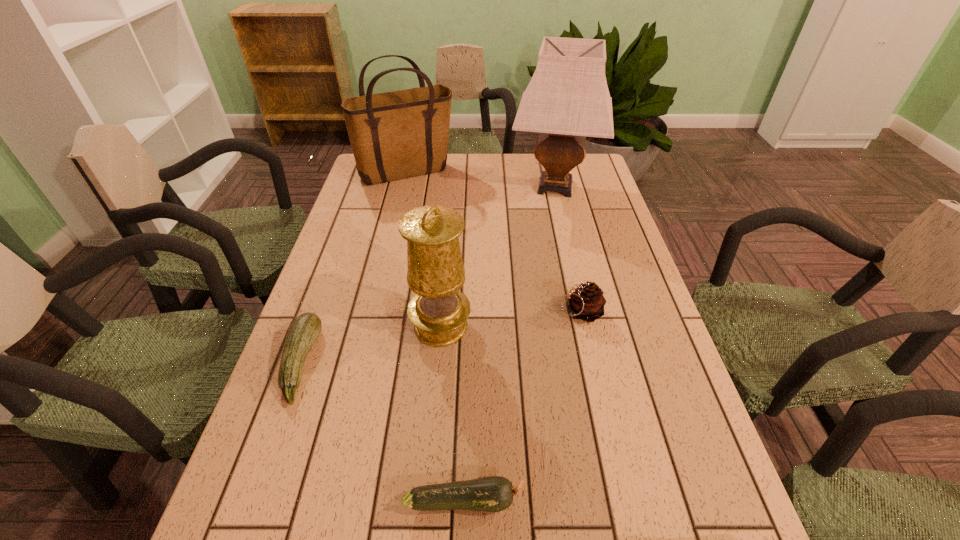
I want to click on lampshade at the right edge, so click(567, 99).

Locate an element on the screen. This screenshot has height=540, width=960. pinecone that is positioned at the right edge is located at coordinates (587, 303).

Identify the location of object that is at the far left corner. (400, 134).

You are a GUI agent. You are given a task and a screenshot of the screen. Output one action in this format:
    pyautogui.click(x=<x>, y=<y>)
    Task: Click on the object located in the far right corner section of the desktop
    The height and width of the screenshot is (540, 960).
    Given the screenshot: What is the action you would take?
    [x=567, y=99]

Identify the location of free space at the left edge of the desktop. This screenshot has width=960, height=540. (353, 295).

The width and height of the screenshot is (960, 540). Find the location of `vacant space at the right edge`. vacant space at the right edge is located at coordinates tap(622, 247).

Image resolution: width=960 pixels, height=540 pixels. What are the coordinates of `vacant space that's between the pinecone and the oil lamp` in the screenshot? It's located at (511, 319).

The width and height of the screenshot is (960, 540). Find the location of `vacant space that is in between the pinecone and the lampshade`. vacant space that is in between the pinecone and the lampshade is located at coordinates 567,249.

You are a GUI agent. You are given a task and a screenshot of the screen. Output one action in this format:
    pyautogui.click(x=<x>, y=<y>)
    Task: Click on the vacant area between the oil lamp and the lampshade
    
    Given the screenshot: What is the action you would take?
    pyautogui.click(x=498, y=256)

Choose which object is the third nearest neighbor to the farther zucchini. Please provide its 2D coordinates. Your answer should be formatted as a tuple, i.e. [(x, y)], where the tuple contains the x and y coordinates of a point satisfying the conditions above.

[(587, 303)]